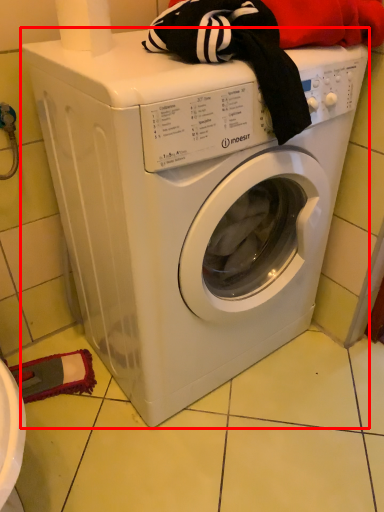
Question: From the image's perspective, what is the correct spatial positioning of washing machine (annotated by the red box) in reference to toilet paper?

Choices:
 (A) above
 (B) below

Answer: (B)